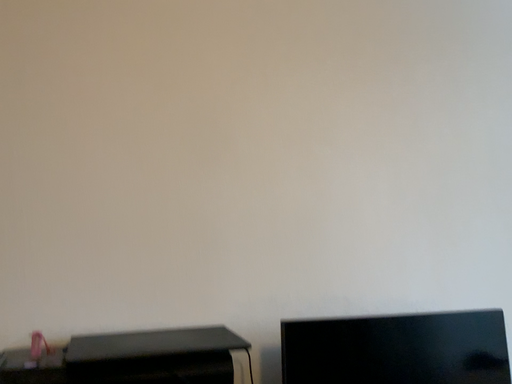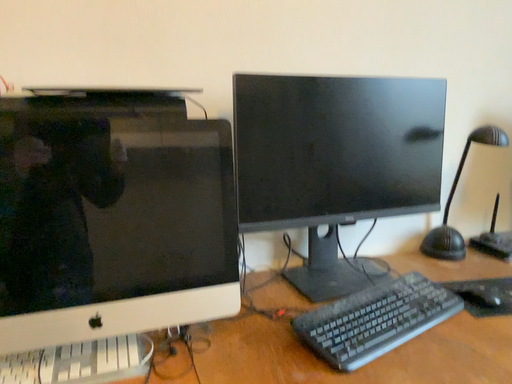
Question: Which way did the camera rotate in the video?

Choices:
 (A) rotated downward
 (B) rotated upward

Answer: (A)